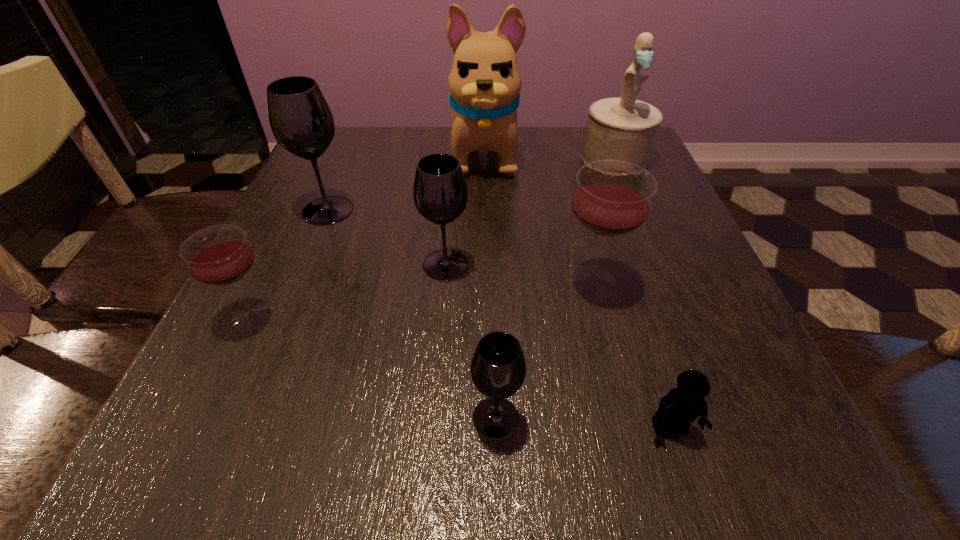
Locate an element on the screen. The image size is (960, 540). beige puppy is located at coordinates (484, 83).

Image resolution: width=960 pixels, height=540 pixels. What are the coordinates of `the tallest object` in the screenshot? It's located at (484, 83).

I want to click on white figurine, so click(622, 128).

Find the location of a particular element. This screenshot has width=960, height=540. the farthest gray wineglass is located at coordinates (302, 123).

Image resolution: width=960 pixels, height=540 pixels. Find the location of `the farthest wineglass`. the farthest wineglass is located at coordinates (302, 123).

Image resolution: width=960 pixels, height=540 pixels. I want to click on the rightmost wineglass, so click(612, 198).

You are a GUI agent. You are given a task and a screenshot of the screen. Output one action in this format:
    pyautogui.click(x=<x>, y=<y>)
    Task: Click on the right red wineglass
    This screenshot has height=540, width=960.
    Given the screenshot: What is the action you would take?
    point(612,198)

You are a GUI agent. You are given a task and a screenshot of the screen. Output one action in this format:
    pyautogui.click(x=<x>, y=<y>)
    Task: Click on the second smallest gray wineglass
    
    Given the screenshot: What is the action you would take?
    pyautogui.click(x=440, y=193)

The image size is (960, 540). Identify the location of the second farthest gray wineglass. (440, 193).

The width and height of the screenshot is (960, 540). In order to click on the left red wineglass in this screenshot , I will do `click(220, 255)`.